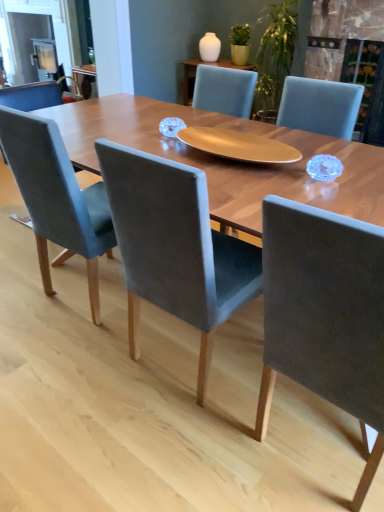
Question: In the image, is suede-like gray chair at center, positioned as the third chair in left-to-right order, positioned in front of or behind velvet grey chair at left, acting as the 3th chair starting from the right?

Choices:
 (A) behind
 (B) front

Answer: (B)

Question: From the image's perspective, relative to velvet grey chair at left, acting as the 3th chair starting from the right, is suede-like gray chair at center, the 1th chair in the right-to-left sequence, above or below?

Choices:
 (A) above
 (B) below

Answer: (B)

Question: Estimate the real-world distances between objects in this image. Which object is closer to the velvet grey chair at left, the 1th chair when ordered from left to right?

Choices:
 (A) velvet grey chair at center, marked as the second chair in a left-to-right arrangement
 (B) suede-like gray chair at center, positioned as the third chair in left-to-right order

Answer: (A)

Question: Considering the real-world distances, which object is farthest from the velvet grey chair at left, the 1th chair when ordered from left to right?

Choices:
 (A) velvet grey chair at center, marked as the second chair in a left-to-right arrangement
 (B) suede-like gray chair at center, positioned as the third chair in left-to-right order

Answer: (B)